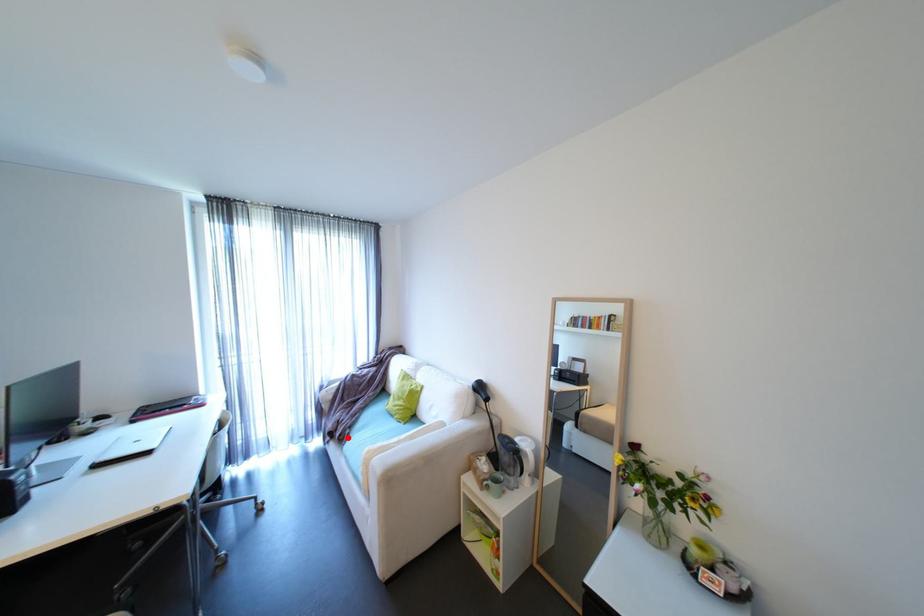
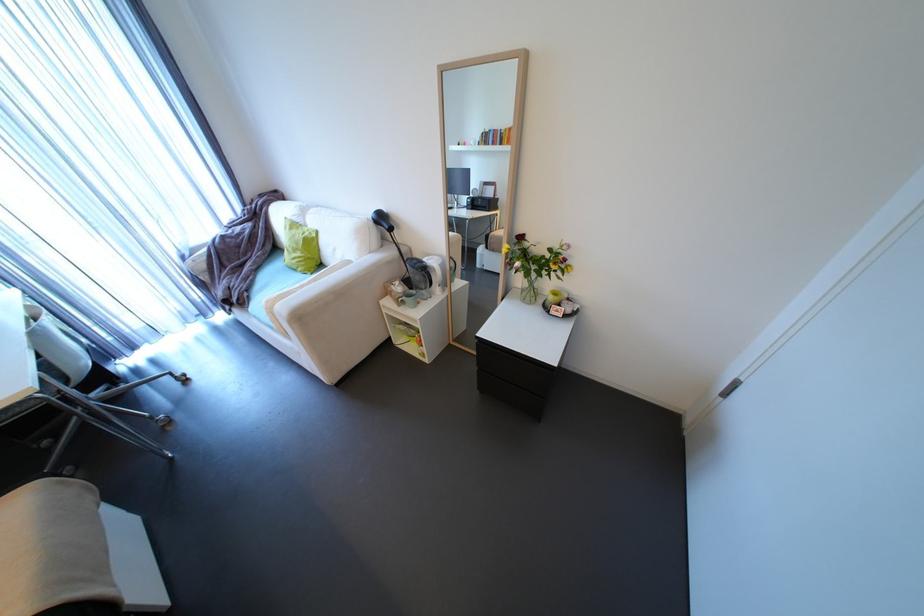
Question: I am providing you with two images of the same scene from different viewpoints. Image1 has a red point marked. In image2, the corresponding 3D location appears at what relative position? Reply with the corresponding letter.

Choices:
 (A) Closer
 (B) Farther

Answer: (B)